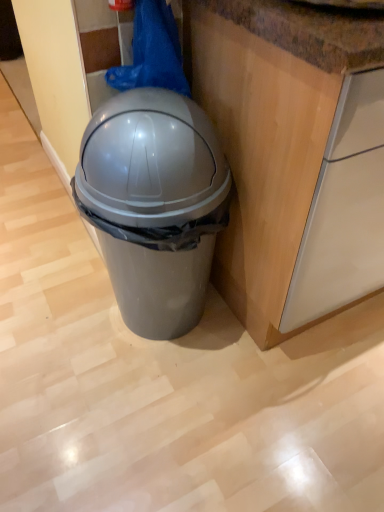
Locate an element on the screen. The height and width of the screenshot is (512, 384). free spot to the right of matte gray plastic trash can at center is located at coordinates (266, 356).